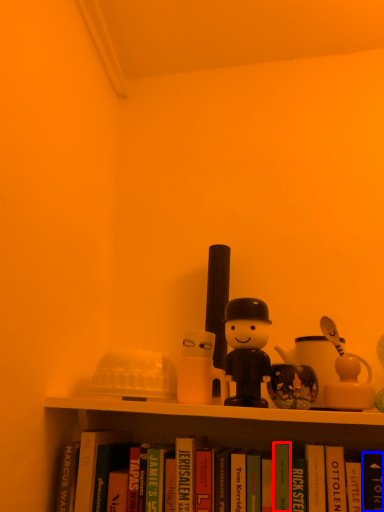
Question: Which object appears farthest to the camera in this image, paperback book (highlighted by a red box) or paperback book (highlighted by a blue box)?

Choices:
 (A) paperback book
 (B) paperback book

Answer: (A)